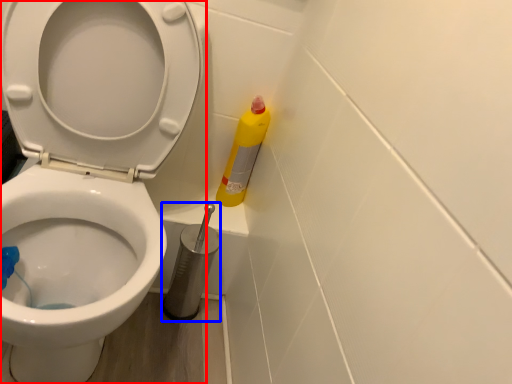
Question: Which object appears closest to the camera in this image, toilet (highlighted by a red box) or brush (highlighted by a blue box)?

Choices:
 (A) toilet
 (B) brush

Answer: (A)